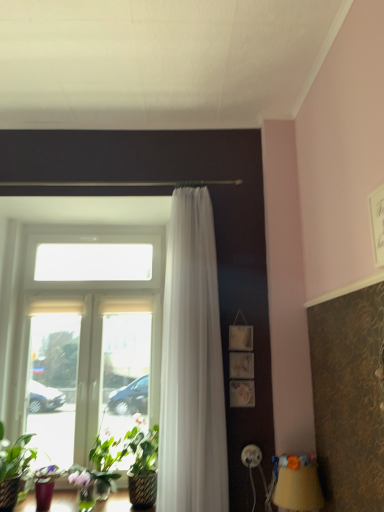
Locate an element on the screen. This screenshot has height=512, width=384. free point above clear glass window at center (from a real-world perspective) is located at coordinates (72, 221).